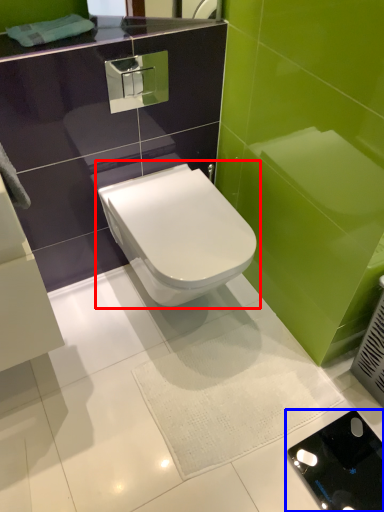
Question: Among these objects, which one is farthest to the camera, toilet (highlighted by a red box) or porcelain (highlighted by a blue box)?

Choices:
 (A) toilet
 (B) porcelain

Answer: (B)